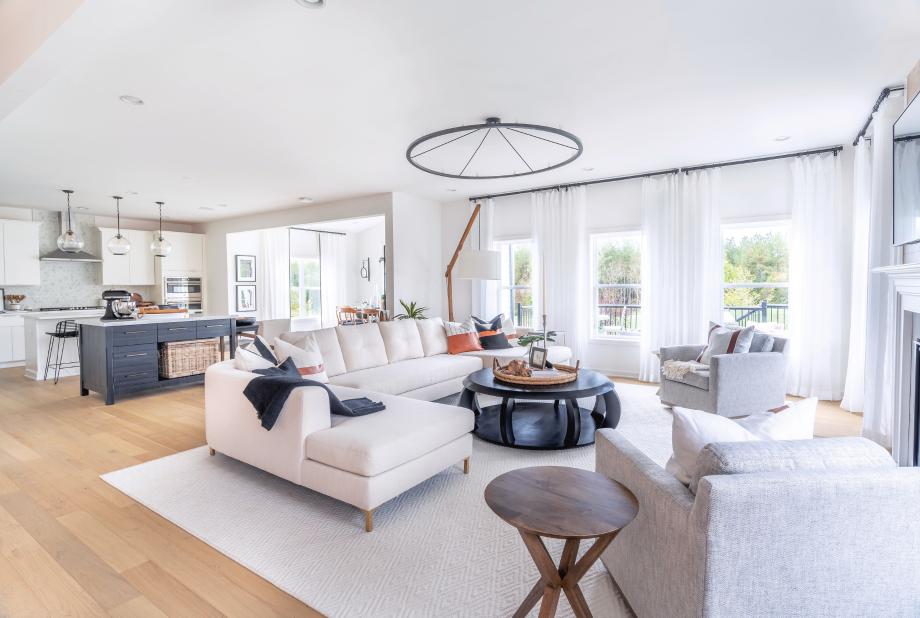
Identify the location of side table. This screenshot has width=920, height=618. (550, 502).